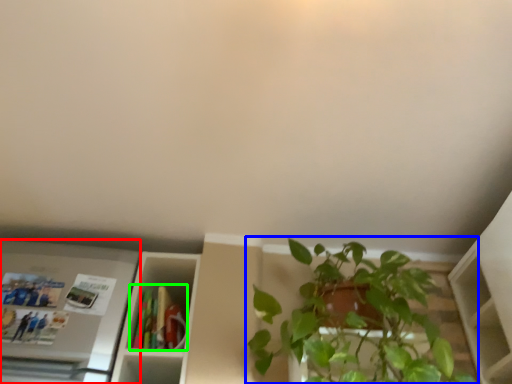
Question: Based on their relative distances, which object is farther from appliance (highlighted by a red box)? Choose from houseplant (highlighted by a blue box) and book (highlighted by a green box).

Choices:
 (A) houseplant
 (B) book

Answer: (A)